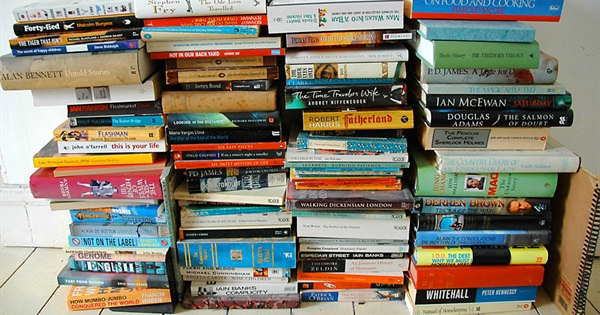
Where is `white floor tiles`? This screenshot has width=600, height=315. white floor tiles is located at coordinates (11, 258), (24, 285), (53, 303), (106, 310), (202, 311), (267, 311), (319, 309), (365, 310), (542, 309), (594, 288).